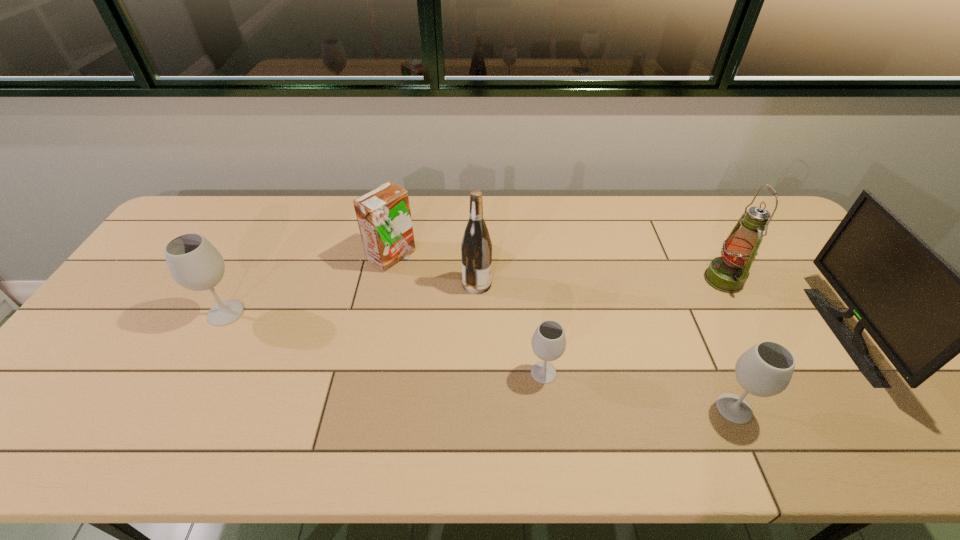
The image size is (960, 540). I want to click on the farthest wineglass, so click(194, 263).

This screenshot has height=540, width=960. I want to click on the leftmost object, so click(194, 263).

The image size is (960, 540). Find the location of `the shortest wineglass`. the shortest wineglass is located at coordinates (548, 342).

Where is `the fourth object from right to left`? This screenshot has height=540, width=960. the fourth object from right to left is located at coordinates (548, 342).

Find the location of `the rightmost wineglass`. the rightmost wineglass is located at coordinates (764, 370).

Locate an element on the screen. Image resolution: width=960 pixels, height=540 pixels. the nearest wineglass is located at coordinates (764, 370).

Where is `wine bottle`? Image resolution: width=960 pixels, height=540 pixels. wine bottle is located at coordinates (476, 248).

Where is `the sixth object from left to right`? This screenshot has width=960, height=540. the sixth object from left to right is located at coordinates (728, 273).

Identify the location of the second object from left to right. The height and width of the screenshot is (540, 960). (383, 214).

Identify the location of the rightmost object. (921, 312).